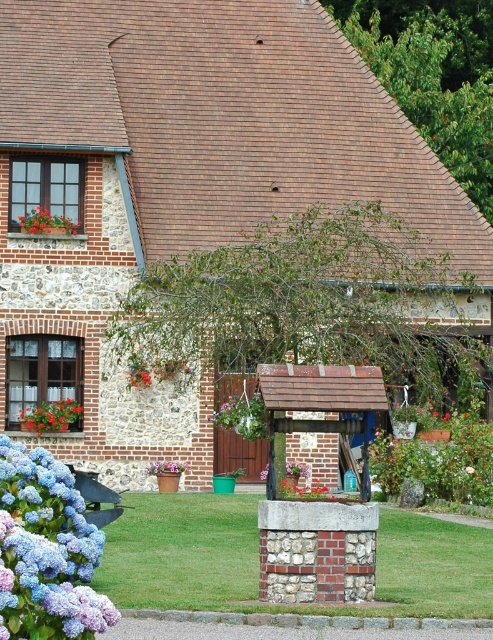
You are planning to place a small decorative garden statue that is 1 meter wide in the area between the green grass at center and the green leafy bush at center. Based on their widths, which object should you place the statue next to to ensure it fits comfortably?

The green grass at center is wider than the green leafy bush at center, so placing the statue next to the green grass at center would provide enough space for it to fit comfortably.

You are standing at the entrance of the traditional stone and brick house with a steeply pitched roof covered in reddish brown tiles. You see a window with dark wooden frames on the upper floor, a decorative well structure in front of the house, and the green leafy bush at center represented by point (437, 464). Which object is located closest to the entrance?

The green leafy bush at center represented by point (437, 464) is closest to the entrance because it is at the center, while the well is in the foreground and the window is on the upper floor.

You are a gardener who wants to plant a new flower in this garden. You have two options based on the image. The first option is to place it near the green grass at center, and the second is near the matte red flower at lower left. Which location would give the flower more space to grow?

The green grass at center has a larger size compared to the matte red flower at lower left, so placing the new flower near the green grass at center would provide more space for growth.